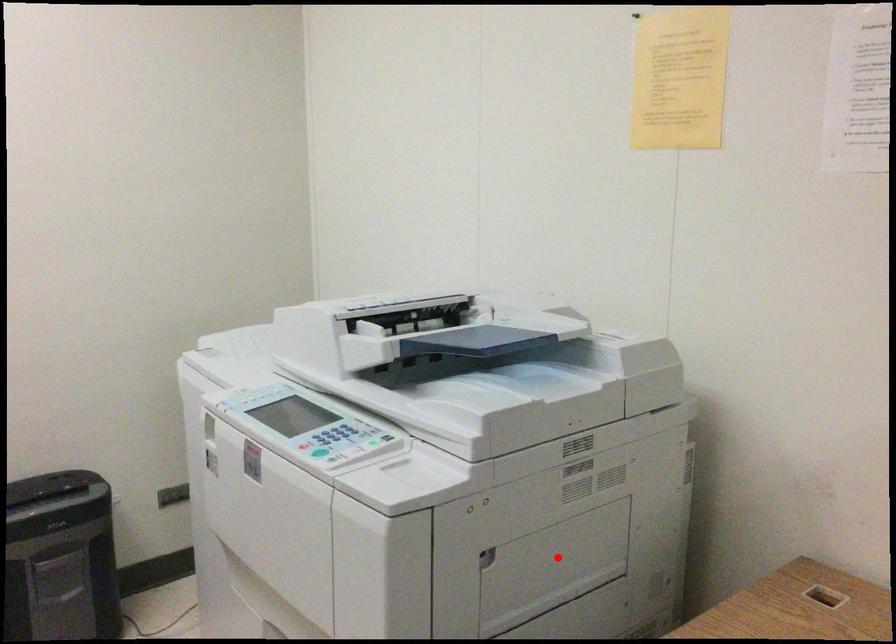
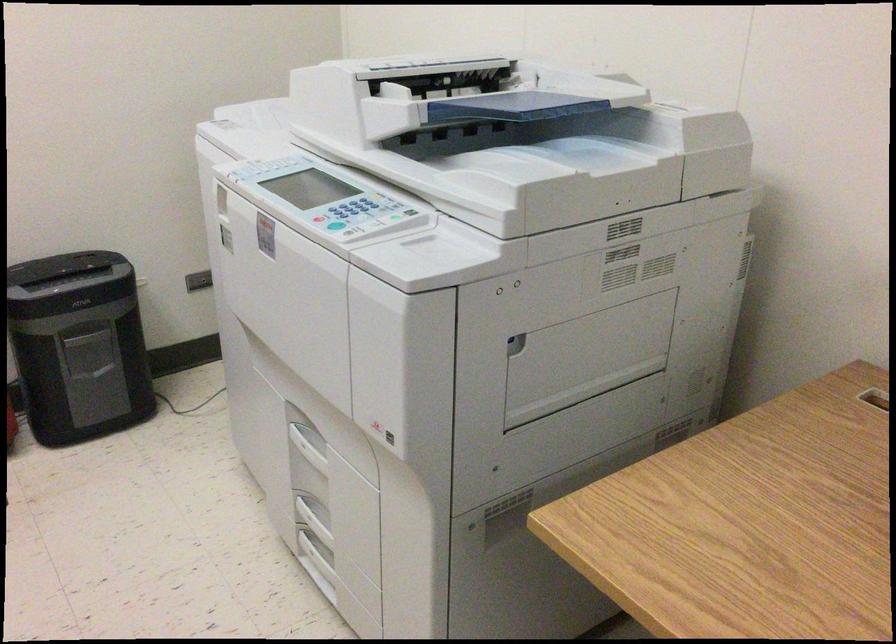
Question: I am providing you with two images of the same scene from different viewpoints. A red point is marked on the first image. Can you still see the location of the red point in image 2?

Choices:
 (A) Yes
 (B) No

Answer: (A)